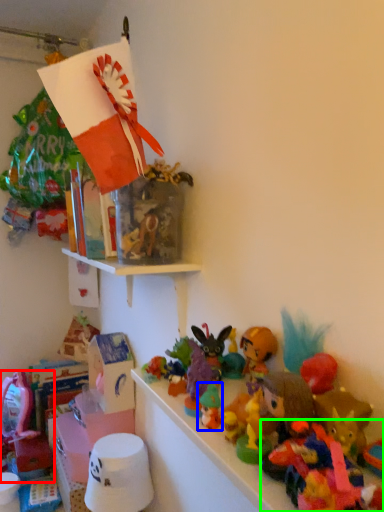
Question: Considering the real-world distances, which object is farthest from toy (highlighted by a red box)? toy (highlighted by a blue box) or toy (highlighted by a green box)?

Choices:
 (A) toy
 (B) toy

Answer: (B)